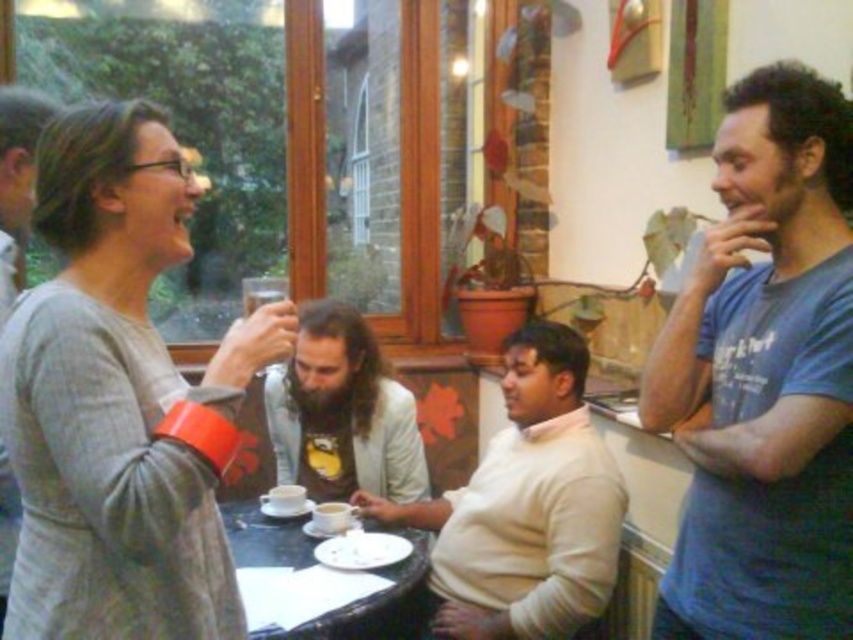
In the scene shown: Can you confirm if blue cotton t-shirt at right is thinner than beige fabric shirt at center?

Correct, blue cotton t-shirt at right's width is less than beige fabric shirt at center's.

Does blue cotton t-shirt at right appear under beige fabric shirt at center?

No.

Where is `blue cotton t-shirt at right`? This screenshot has width=853, height=640. blue cotton t-shirt at right is located at coordinates (764, 376).

In order to click on blue cotton t-shirt at right in this screenshot , I will do `click(764, 376)`.

Does point (706, 285) come behind point (288, 508)?

No, (706, 285) is closer to viewer.

Between point (834, 125) and point (288, 502), which one is positioned behind?

The point (288, 502) is more distant.

This screenshot has width=853, height=640. Identify the location of blue cotton t-shirt at right. (764, 376).

Is point (39, 116) farther from viewer compared to point (250, 304)?

No, (39, 116) is closer to viewer.

Is gray cotton shirt at upper left to the right of matte ceramic cup at center from the viewer's perspective?

Incorrect, gray cotton shirt at upper left is not on the right side of matte ceramic cup at center.

Between point (6, 516) and point (274, 291), which one is positioned behind?

The point (274, 291) is more distant.

Find the location of `gray cotton shirt at upper left`. gray cotton shirt at upper left is located at coordinates (16, 180).